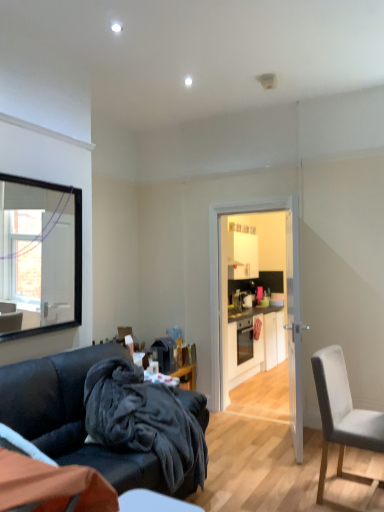
Question: Considering the relative sizes of matte black cabinets at center and transparent glass door at center in the image provided, is matte black cabinets at center wider than transparent glass door at center?

Choices:
 (A) no
 (B) yes

Answer: (B)

Question: From the image's perspective, would you say matte black cabinets at center is positioned over transparent glass door at center?

Choices:
 (A) no
 (B) yes

Answer: (A)

Question: Can we say matte black cabinets at center lies outside transparent glass door at center?

Choices:
 (A) yes
 (B) no

Answer: (A)

Question: Is matte black cabinets at center bigger than transparent glass door at center?

Choices:
 (A) yes
 (B) no

Answer: (A)

Question: Is matte black cabinets at center taller than transparent glass door at center?

Choices:
 (A) yes
 (B) no

Answer: (B)

Question: Is matte black cabinets at center at the right side of transparent glass door at center?

Choices:
 (A) yes
 (B) no

Answer: (A)

Question: From a real-world perspective, is velvet dark blue couch at lower left positioned over dark fleece blanket at lower left based on gravity?

Choices:
 (A) yes
 (B) no

Answer: (B)

Question: From the image's perspective, is velvet dark blue couch at lower left on dark fleece blanket at lower left?

Choices:
 (A) no
 (B) yes

Answer: (A)

Question: Is velvet dark blue couch at lower left in front of dark fleece blanket at lower left?

Choices:
 (A) yes
 (B) no

Answer: (A)

Question: Considering the relative sizes of velvet dark blue couch at lower left and dark fleece blanket at lower left in the image provided, is velvet dark blue couch at lower left bigger than dark fleece blanket at lower left?

Choices:
 (A) yes
 (B) no

Answer: (A)

Question: From the image's perspective, would you say velvet dark blue couch at lower left is shown under dark fleece blanket at lower left?

Choices:
 (A) yes
 (B) no

Answer: (A)

Question: Is velvet dark blue couch at lower left not close to dark fleece blanket at lower left?

Choices:
 (A) no
 (B) yes

Answer: (A)

Question: Is white glossy door at center wider than velvet dark blue couch at lower left?

Choices:
 (A) yes
 (B) no

Answer: (B)